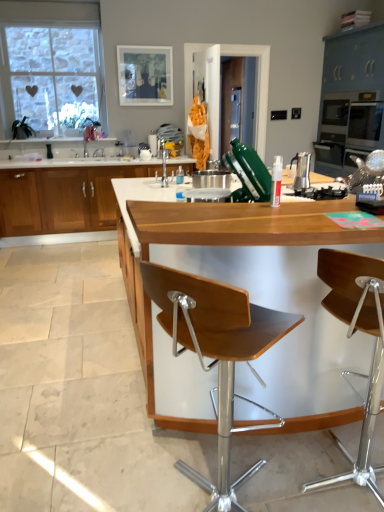
Question: Does wooden at center, the first countertop from the front, have a lesser width compared to wooden seat at center, arranged as the first chair when viewed from the left?

Choices:
 (A) no
 (B) yes

Answer: (A)

Question: Does wooden at center, the second countertop in the top-to-bottom sequence, have a lesser height compared to wooden seat at center, acting as the 2th chair starting from the right?

Choices:
 (A) yes
 (B) no

Answer: (B)

Question: Does wooden at center, the second countertop viewed from the back, have a greater height compared to wooden seat at center, arranged as the first chair when viewed from the left?

Choices:
 (A) no
 (B) yes

Answer: (B)

Question: Is wooden at center, the second countertop in the top-to-bottom sequence, directly adjacent to wooden seat at center, acting as the 2th chair starting from the right?

Choices:
 (A) no
 (B) yes

Answer: (A)

Question: Would you consider wooden at center, the second countertop in the top-to-bottom sequence, to be distant from wooden seat at center, arranged as the first chair when viewed from the left?

Choices:
 (A) no
 (B) yes

Answer: (A)

Question: Does point (54, 167) appear closer or farther from the camera than point (375, 351)?

Choices:
 (A) closer
 (B) farther

Answer: (B)

Question: Looking at their shapes, would you say wooden cabinet at left, arranged as the 1th cabinetry when viewed from the left, is wider or thinner than wooden seat at center, the 2th chair when ordered from left to right?

Choices:
 (A) thin
 (B) wide

Answer: (B)

Question: In terms of size, does wooden cabinet at left, arranged as the 1th cabinetry when viewed from the left, appear bigger or smaller than wooden seat at center, the 1th chair in the right-to-left sequence?

Choices:
 (A) small
 (B) big

Answer: (B)

Question: Is wooden cabinet at left, placed as the 2th cabinetry when sorted from right to left, situated inside wooden seat at center, the 1th chair in the right-to-left sequence, or outside?

Choices:
 (A) inside
 (B) outside

Answer: (B)

Question: Considering the positions of point (301, 185) and point (44, 159), is point (301, 185) closer or farther from the camera than point (44, 159)?

Choices:
 (A) farther
 (B) closer

Answer: (B)

Question: Is satin silver espresso maker at center to the left or to the right of white glossy countertop at center, which appears as the first countertop when viewed from the top, in the image?

Choices:
 (A) right
 (B) left

Answer: (A)

Question: Is satin silver espresso maker at center inside or outside of white glossy countertop at center, which ranks as the second countertop in bottom-to-top order?

Choices:
 (A) outside
 (B) inside

Answer: (A)

Question: Considering the positions of satin silver espresso maker at center and white glossy countertop at center, which is counted as the second countertop, starting from the front, in the image, is satin silver espresso maker at center wider or thinner than white glossy countertop at center, which is counted as the second countertop, starting from the front,?

Choices:
 (A) wide
 (B) thin

Answer: (B)

Question: Is wooden seat at center, arranged as the first chair when viewed from the left, inside or outside of wooden at center, the second countertop viewed from the back?

Choices:
 (A) outside
 (B) inside

Answer: (B)

Question: Considering the positions of wooden seat at center, acting as the 2th chair starting from the right, and wooden at center, the second countertop in the top-to-bottom sequence, in the image, is wooden seat at center, acting as the 2th chair starting from the right, taller or shorter than wooden at center, the second countertop in the top-to-bottom sequence,?

Choices:
 (A) tall
 (B) short

Answer: (B)